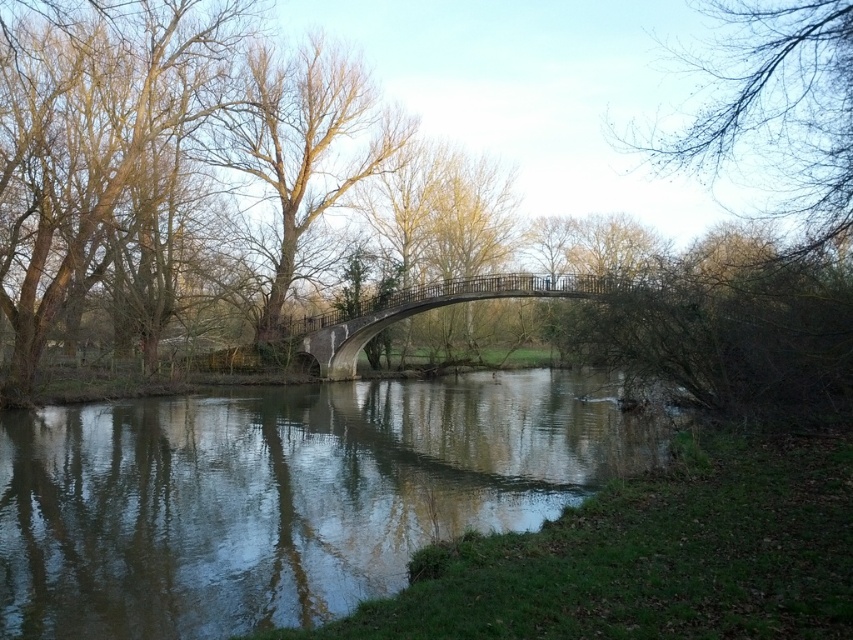
You are standing at the center of the small arched bridge spanning over a calm river. You notice a point marked at coordinate [358,156]. What object is located at that point?

The point at coordinate [358,156] marks a brown leafless tree at center.

You are an artist planning to sketch this scene. You want to ensure the brown leafless tree at center and the stone gray bridge at center are proportionally accurate. Which object should you draw larger in your sketch?

The brown leafless tree at center should be drawn larger than the stone gray bridge at center because it is bigger in the scene.

You are a bird flying over the serene natural scene. You want to land on the smooth reflective water at center but need to avoid the bare branches at upper right. Given their distance, is it possible to safely land without hitting the branches?

The smooth reflective water at center and bare branches at upper right are 12.21 meters apart from each other. Since the distance is significant, the bird can safely land on the smooth reflective water at center without hitting the bare branches at upper right.